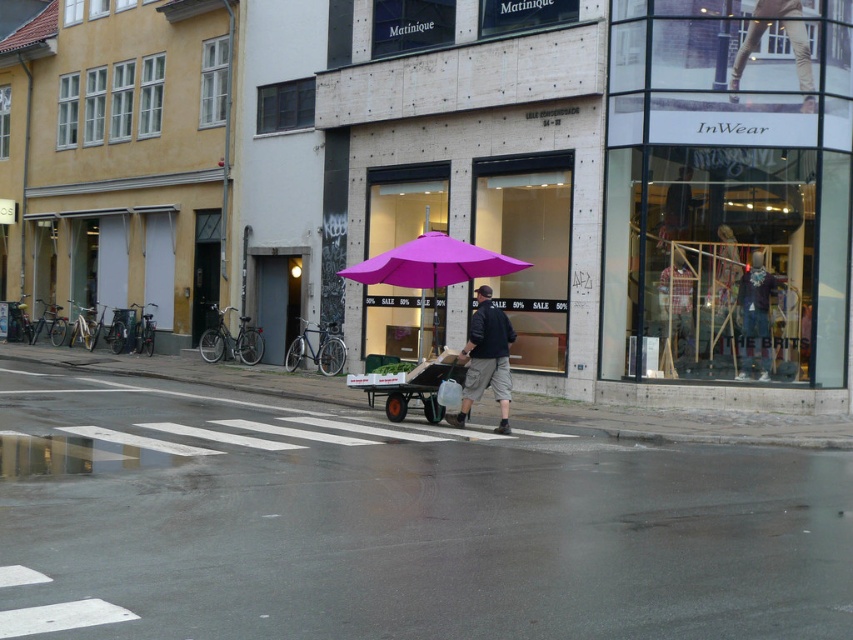
You are a pedestrian looking to cross the street. You see a man with a purple umbrella cart at center. He is wearing two jackets, the matte black jacket at center and the denim jacket at center. Which jacket is positioned to the left?

The matte black jacket at center is to the left of the denim jacket at center.

You are a delivery person who needs to choose a jacket to protect yourself from the rain. The scene shows a matte black jacket at center and a denim jacket at center. Which jacket takes up less space and would be easier to carry?

The matte black jacket at center occupies less space than the denim jacket at center, so it would be easier to carry.

You are a fashion designer observing a man in an urban setting. You notice the dark blue cotton shirt at center and the matte black jacket at center. Which clothing item has a greater width?

The dark blue cotton shirt at center has a greater width than the matte black jacket at center according to the description provided.